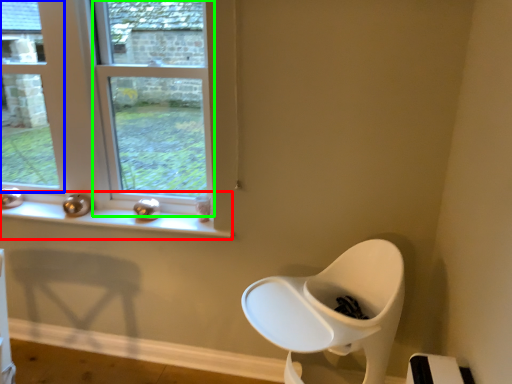
Question: Based on their relative distances, which object is nearer to window sill (highlighted by a red box)? Choose from window (highlighted by a blue box) and window (highlighted by a green box).

Choices:
 (A) window
 (B) window

Answer: (B)